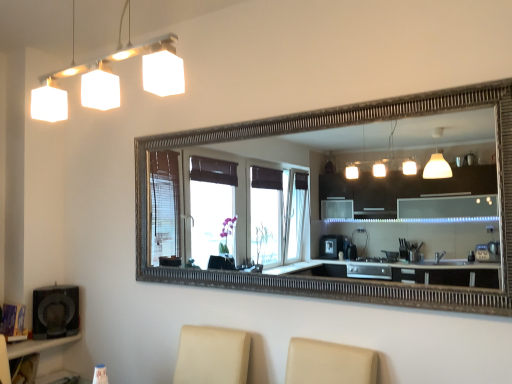
Question: Is matte black shelf at lower left located outside matte black speaker at lower left?

Choices:
 (A) yes
 (B) no

Answer: (A)

Question: Is matte black shelf at lower left positioned with its back to matte black speaker at lower left?

Choices:
 (A) no
 (B) yes

Answer: (A)

Question: Does matte black shelf at lower left come behind matte black speaker at lower left?

Choices:
 (A) yes
 (B) no

Answer: (B)

Question: Is matte black shelf at lower left surrounding matte black speaker at lower left?

Choices:
 (A) yes
 (B) no

Answer: (B)

Question: Is matte black shelf at lower left smaller than matte black speaker at lower left?

Choices:
 (A) no
 (B) yes

Answer: (A)

Question: Considering the positions of matte black shelf at lower left and white matte square light fixture at upper left in the image, is matte black shelf at lower left taller or shorter than white matte square light fixture at upper left?

Choices:
 (A) tall
 (B) short

Answer: (A)

Question: From a real-world perspective, is matte black shelf at lower left positioned above or below white matte square light fixture at upper left?

Choices:
 (A) below
 (B) above

Answer: (A)

Question: Is point coord(13,350) closer or farther from the camera than point coord(49,114)?

Choices:
 (A) farther
 (B) closer

Answer: (B)

Question: Is matte black shelf at lower left inside or outside of white matte square light fixture at upper left?

Choices:
 (A) outside
 (B) inside

Answer: (A)

Question: In the image, is matte black speaker at lower left positioned in front of or behind matte black shelf at lower left?

Choices:
 (A) front
 (B) behind

Answer: (B)

Question: Is matte black speaker at lower left inside the boundaries of matte black shelf at lower left, or outside?

Choices:
 (A) outside
 (B) inside

Answer: (A)

Question: Is matte black speaker at lower left bigger or smaller than matte black shelf at lower left?

Choices:
 (A) big
 (B) small

Answer: (B)

Question: From a real-world perspective, is matte black speaker at lower left physically located above or below matte black shelf at lower left?

Choices:
 (A) above
 (B) below

Answer: (A)

Question: From a real-world perspective, relative to white matte square light fixture at upper left, is matte black speaker at lower left vertically above or below?

Choices:
 (A) below
 (B) above

Answer: (A)

Question: Does point (77, 311) appear closer or farther from the camera than point (160, 56)?

Choices:
 (A) closer
 (B) farther

Answer: (B)